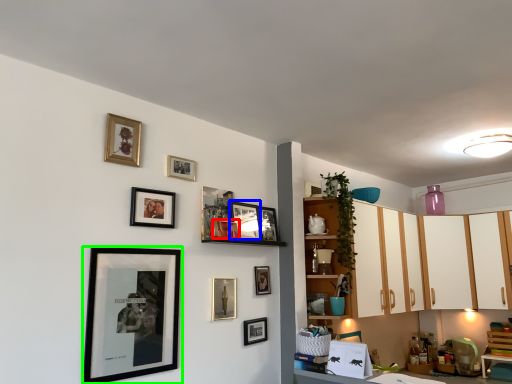
Question: Estimate the real-world distances between objects in this image. Which object is closer to picture frame (highlighted by a red box), picture frame (highlighted by a blue box) or picture frame (highlighted by a green box)?

Choices:
 (A) picture frame
 (B) picture frame

Answer: (A)